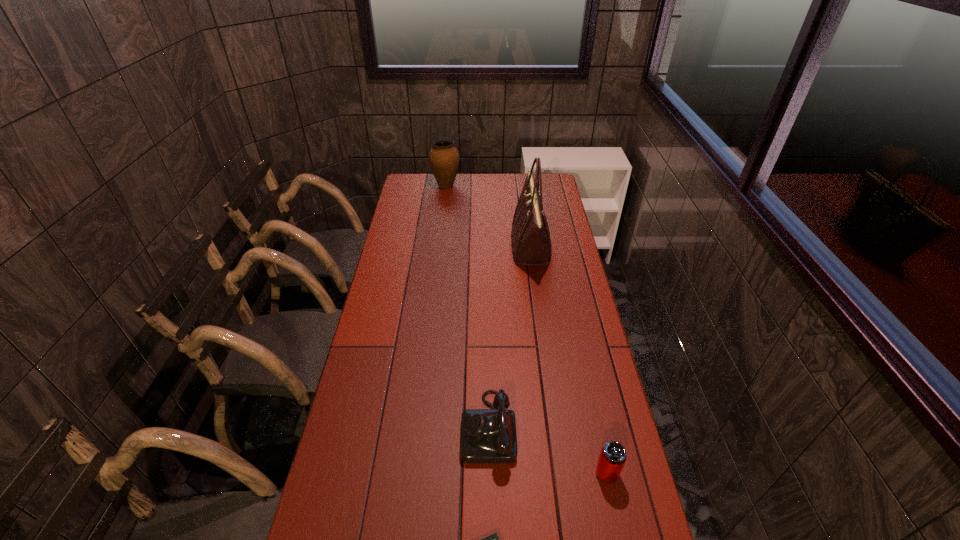
The height and width of the screenshot is (540, 960). In the image, there is a desktop. In order to click on vacant region at the left edge in this screenshot , I will do `click(421, 228)`.

Find the location of a particular element. The image size is (960, 540). vacant space at the right edge of the desktop is located at coordinates (559, 366).

The height and width of the screenshot is (540, 960). In order to click on free space at the far left corner of the desktop in this screenshot , I will do `click(425, 195)`.

In the image, there is a desktop. Where is `vacant space at the far right corner`? vacant space at the far right corner is located at coordinates (546, 180).

Where is `blank region between the handbag and the leftmost object`? blank region between the handbag and the leftmost object is located at coordinates (489, 217).

Where is `free space between the handbag and the telephone`? The image size is (960, 540). free space between the handbag and the telephone is located at coordinates (510, 337).

You are a GUI agent. You are given a task and a screenshot of the screen. Output one action in this format:
    pyautogui.click(x=<x>, y=<y>)
    Task: Click on the free space between the soda can and the telephone
    Image resolution: width=960 pixels, height=540 pixels.
    Given the screenshot: What is the action you would take?
    pyautogui.click(x=547, y=450)

Identify which object is the second closest to the telephone. Please provide its 2D coordinates. Your answer should be formatted as a tuple, i.e. [(x, y)], where the tuple contains the x and y coordinates of a point satisfying the conditions above.

[(612, 458)]

The width and height of the screenshot is (960, 540). What are the coordinates of `the second closest object relative to the tallest object` in the screenshot? It's located at (487, 435).

I want to click on vacant space that satisfies the following two spatial constraints: 1. on the dial of the soda can; 2. on the left side of the telephone, so pos(489,473).